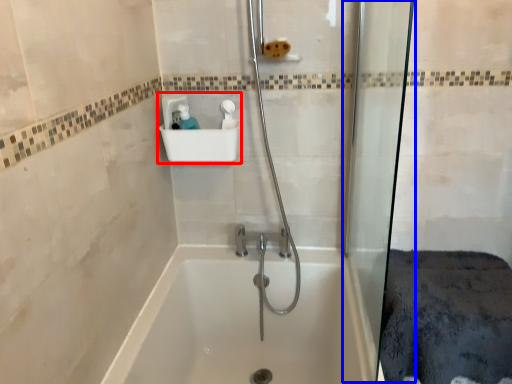
Question: Which object appears closest to the camera in this image, sink (highlighted by a red box) or shower door (highlighted by a blue box)?

Choices:
 (A) sink
 (B) shower door

Answer: (B)